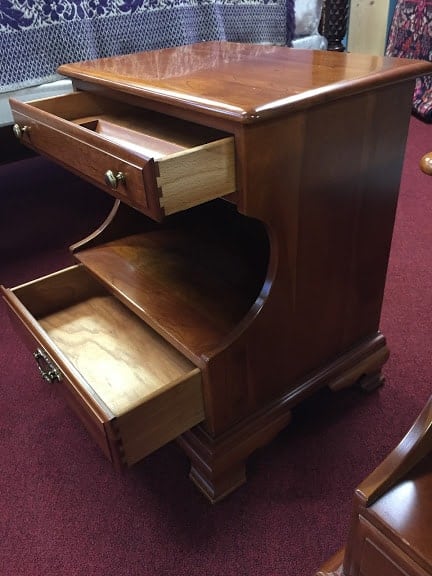
Where is `upper knobs`? This screenshot has width=432, height=576. upper knobs is located at coordinates (112, 178), (18, 131).